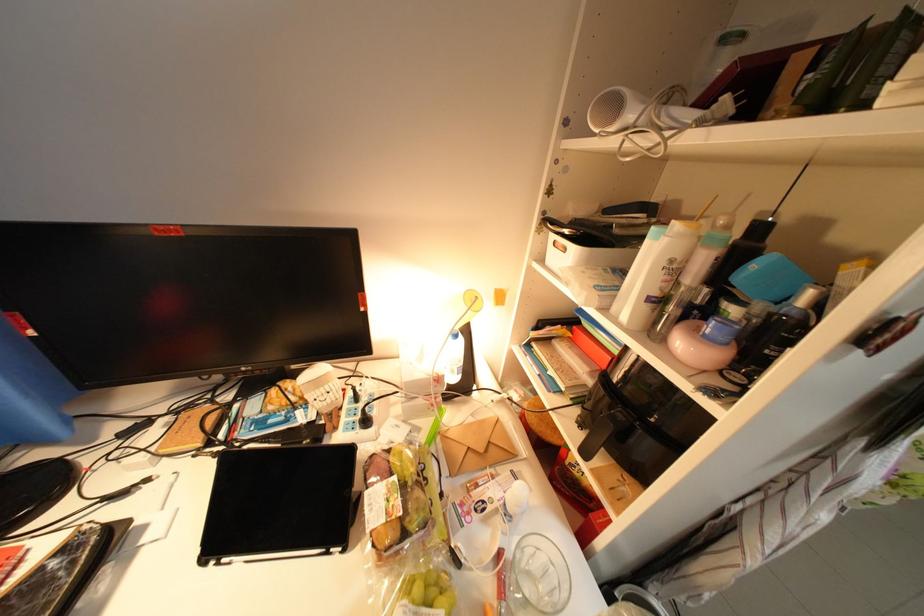
Where would you lift the white shampoo bottle? Please return your answer as a coordinate pair (x, y).

(657, 275)